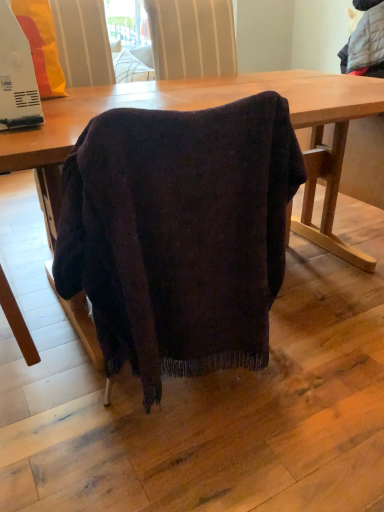
Image resolution: width=384 pixels, height=512 pixels. In order to click on free space in front of dark wood table at center in this screenshot , I will do `click(178, 454)`.